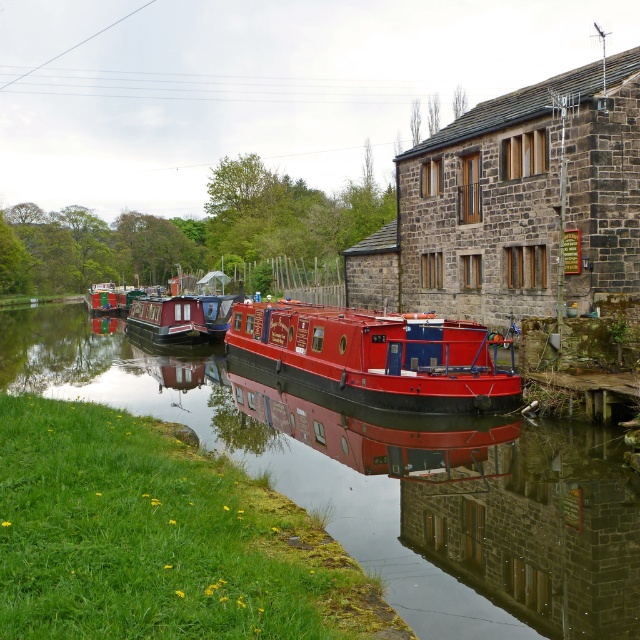
You are a visitor standing on the grassy bank of the canal and want to board the closest boat. Which boat should you choose between the smooth red canal boat at center and the red polished wooden boat at center?

The smooth red canal boat at center is shorter than the red polished wooden boat at center, so the smooth red canal boat at center is closer to the grassy bank. You should choose the smooth red canal boat at center.

Looking at this image, you are a photographer planning to capture both the smooth red canal boat at center and the metallic red canal boat at left in a single shot. Based on their sizes in the image, which boat should you focus on to ensure both fit comfortably in the frame?

The smooth red canal boat at center occupies less space than the metallic red canal boat at left, so focusing on the larger metallic red canal boat at left will help ensure both fit comfortably in the frame.